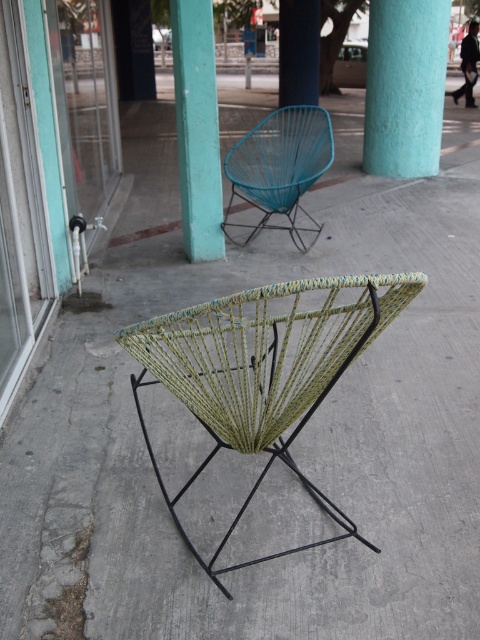
Question: Is teal matte/rough pillar at center smaller than teal matte/rough pillar at upper center?

Choices:
 (A) no
 (B) yes

Answer: (B)

Question: In this image, where is teal matte/rough pillar at upper center located relative to teal woven chair at upper center?

Choices:
 (A) left
 (B) right

Answer: (A)

Question: Based on their relative distances, which object is farther from the teal matte/rough pillar at upper center?

Choices:
 (A) teal matte/rough pillar at center
 (B) green woven chair at center

Answer: (A)

Question: Which point appears closest to the camera in this image?

Choices:
 (A) (377, 84)
 (B) (193, 410)

Answer: (B)

Question: Is teal matte/rough pillar at center to the left of teal matte/rough pillar at upper center from the viewer's perspective?

Choices:
 (A) no
 (B) yes

Answer: (A)

Question: Considering the real-world distances, which object is farthest from the green woven chair at center?

Choices:
 (A) teal matte/rough pillar at center
 (B) teal matte/rough pillar at upper center
 (C) teal woven chair at upper center

Answer: (A)